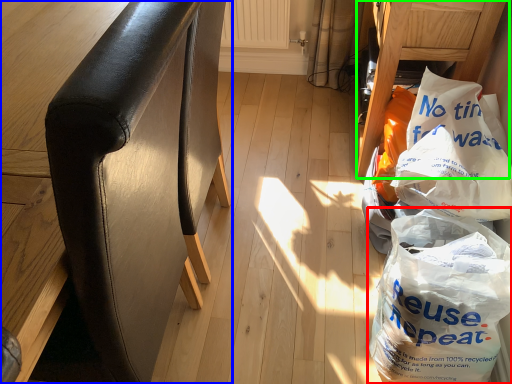
Question: Which object is the closest to the plastic bag (highlighted by a red box)? Choose among these: furniture (highlighted by a blue box) or furniture (highlighted by a green box).

Choices:
 (A) furniture
 (B) furniture

Answer: (B)